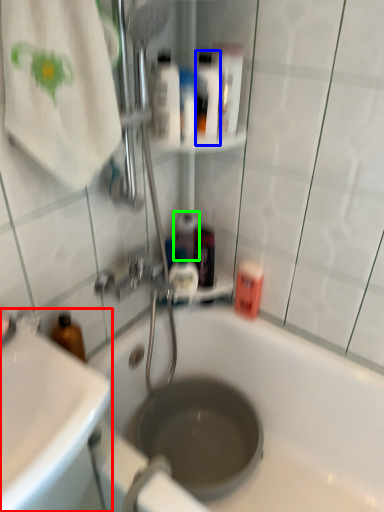
Question: Considering the real-world distances, which object is farthest from sink (highlighted by a red box)? mouthwash (highlighted by a blue box) or mouthwash (highlighted by a green box)?

Choices:
 (A) mouthwash
 (B) mouthwash

Answer: (A)